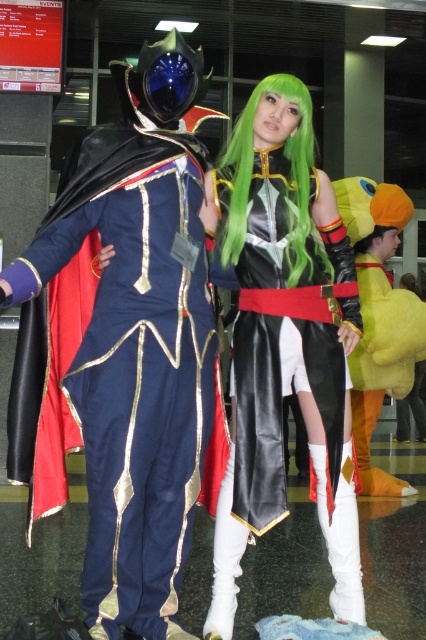
Is shiny blue fabric cape at left positioned in front of black leather dress at center?

That is True.

From the picture: Between shiny blue fabric cape at left and black leather dress at center, which one appears on the left side from the viewer's perspective?

shiny blue fabric cape at left is more to the left.

Which is in front, point (192, 448) or point (252, 435)?

Positioned in front is point (192, 448).

The width and height of the screenshot is (426, 640). I want to click on shiny blue fabric cape at left, so click(137, 380).

Is shiny blue fabric cape at left shorter than green matte wig at center?

No.

Who is more forward, (86,161) or (227,237)?

Point (86,161) is more forward.

The image size is (426, 640). I want to click on shiny blue fabric cape at left, so click(x=137, y=380).

Does black leather dress at center have a larger size compared to green matte wig at center?

Indeed, black leather dress at center has a larger size compared to green matte wig at center.

Looking at this image, who is shorter, black leather dress at center or green matte wig at center?

green matte wig at center is shorter.

Locate an element on the screen. black leather dress at center is located at coordinates (284, 339).

The height and width of the screenshot is (640, 426). What are the coordinates of `black leather dress at center` in the screenshot? It's located at (284, 339).